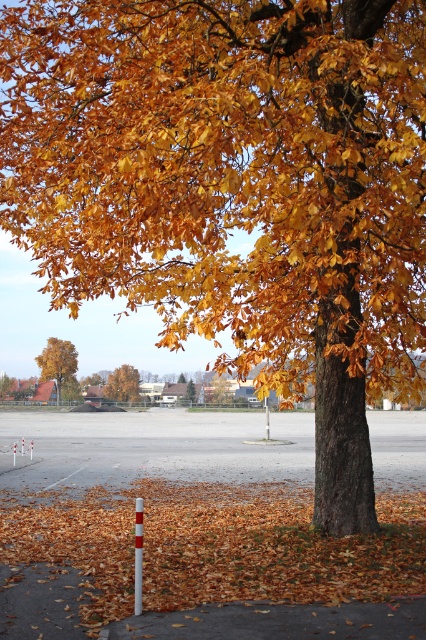
You are standing at the center of the image and want to pick up the brown leaf litter at lower center. Which direction should you move to reach it?

The brown leaf litter at lower center is located at point (213, 545), so you should move to the lower center direction to reach it.